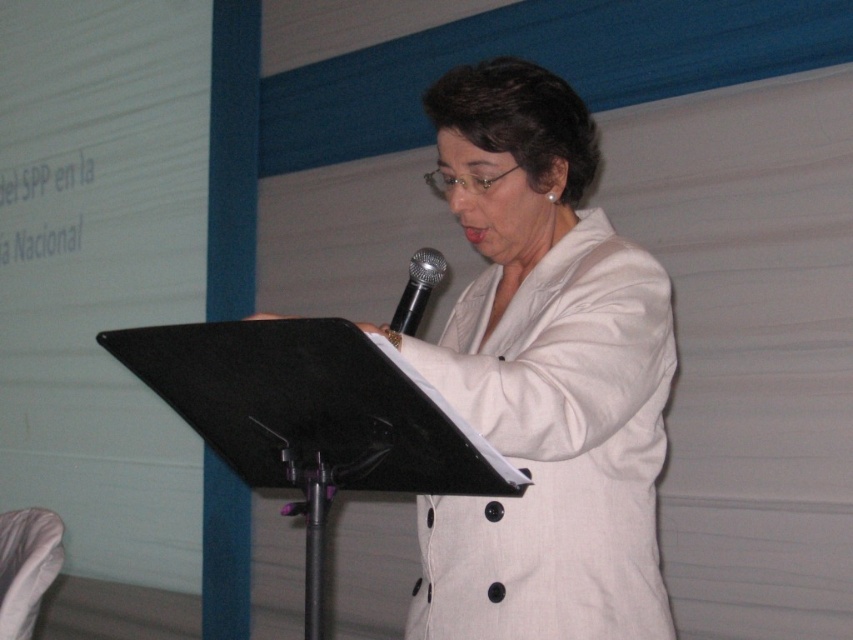
Consider the image. Is white fabric coat at center positioned before black metallic microphone at center?

Yes, it is.

Does white fabric coat at center have a lesser width compared to black metallic microphone at center?

No.

Where is `white fabric coat at center`? white fabric coat at center is located at coordinates (543, 378).